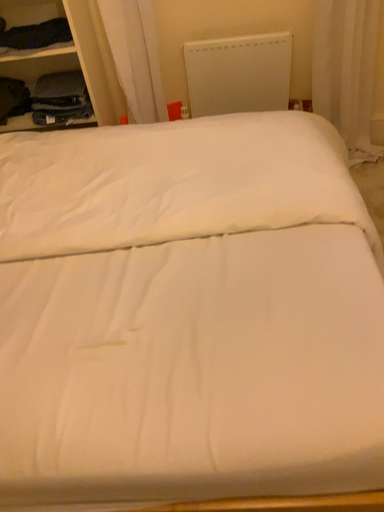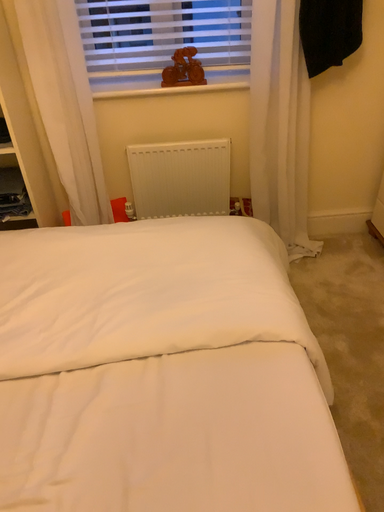
Question: How did the camera likely rotate when shooting the video?

Choices:
 (A) rotated left
 (B) rotated right

Answer: (B)